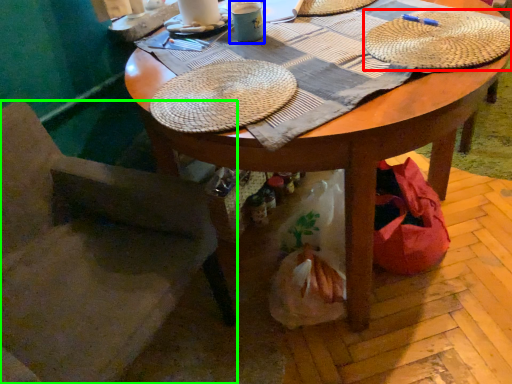
Question: Based on their relative distances, which object is nearer to hat (highlighted by a red box)? Choose from coffee cup (highlighted by a blue box) and chair (highlighted by a green box).

Choices:
 (A) coffee cup
 (B) chair

Answer: (A)